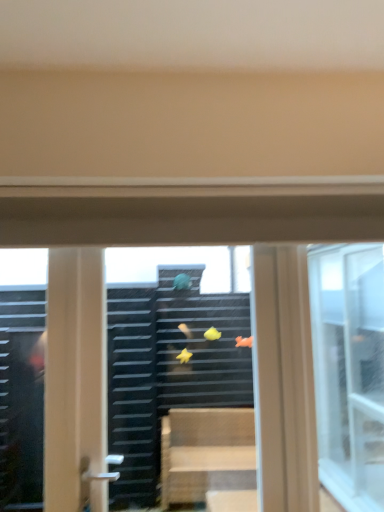
Find the location of a particular element. This screenshot has width=384, height=512. transparent plastic magnets at center is located at coordinates (167, 356).

Find the location of `transparent plastic magnets at center`. transparent plastic magnets at center is located at coordinates (x=167, y=356).

Which object is positioned more to the right, transparent glass window at center, the 1th window from the left, or transparent glass window at center, which ranks as the 2th window in left-to-right order?

From the viewer's perspective, transparent glass window at center, which ranks as the 2th window in left-to-right order, appears more on the right side.

From a real-world perspective, is transparent glass window at center, the 2th window from the right, positioned over transparent glass window at center, acting as the first window starting from the right, based on gravity?

No, from a real-world perspective, transparent glass window at center, the 2th window from the right, is not on top of transparent glass window at center, acting as the first window starting from the right.

Does transparent glass window at center, the 1th window from the left, turn towards transparent glass window at center, which ranks as the 2th window in left-to-right order?

Yes, transparent glass window at center, the 1th window from the left, faces towards transparent glass window at center, which ranks as the 2th window in left-to-right order.

Is transparent glass window at center, the 2th window from the right, a part of transparent glass window at center, acting as the first window starting from the right?

Actually, transparent glass window at center, the 2th window from the right, is outside transparent glass window at center, acting as the first window starting from the right.

From a real-world perspective, which is physically above, transparent glass window at center, which ranks as the 2th window in left-to-right order, or transparent glass window at center, the 1th window from the left?

From a 3D spatial view, transparent glass window at center, which ranks as the 2th window in left-to-right order, is above.

Is transparent glass window at center, acting as the first window starting from the right, in contact with transparent glass window at center, the 1th window from the left?

No, transparent glass window at center, acting as the first window starting from the right, is not touching transparent glass window at center, the 1th window from the left.

Is transparent glass window at center, which ranks as the 2th window in left-to-right order, shorter than transparent glass window at center, the 1th window from the left?

In fact, transparent glass window at center, which ranks as the 2th window in left-to-right order, may be taller than transparent glass window at center, the 1th window from the left.

Can you confirm if transparent plastic magnets at center is taller than transparent glass window at center, which ranks as the 2th window in left-to-right order?

Yes.

This screenshot has width=384, height=512. In order to click on the 2nd window counting from the right of the transparent plastic magnets at center in this screenshot , I will do `click(349, 370)`.

Is point (117, 252) behind point (354, 261)?

No, it is in front of (354, 261).

Who is more distant, transparent glass window at center, which ranks as the 2th window in left-to-right order, or transparent plastic magnets at center?

transparent glass window at center, which ranks as the 2th window in left-to-right order, is further from the camera.

Is transparent glass window at center, acting as the first window starting from the right, positioned with its back to transparent plastic magnets at center?

No, transparent glass window at center, acting as the first window starting from the right,'s orientation is not away from transparent plastic magnets at center.

Is transparent glass window at center, which ranks as the 2th window in left-to-right order, smaller than transparent plastic magnets at center?

Yes, transparent glass window at center, which ranks as the 2th window in left-to-right order, is smaller than transparent plastic magnets at center.

Which is behind, point (186, 366) or point (207, 384)?

The point (186, 366) is farther from the camera.

Relative to transparent plastic magnets at center, is transparent glass window at center, the 2th window from the right, in front or behind?

Clearly, transparent glass window at center, the 2th window from the right, is in front of transparent plastic magnets at center.

Does transparent glass window at center, the 1th window from the left, have a larger size compared to transparent plastic magnets at center?

Yes.

Could you tell me if transparent plastic magnets at center is facing transparent glass window at center, the 2th window from the right?

Yes, transparent plastic magnets at center is aimed at transparent glass window at center, the 2th window from the right.

Can you see transparent plastic magnets at center touching transparent glass window at center, the 1th window from the left?

Yes, transparent plastic magnets at center is right next to transparent glass window at center, the 1th window from the left, and making contact.

From the image's perspective, is transparent plastic magnets at center located beneath transparent glass window at center, the 1th window from the left?

Incorrect, from the image's perspective, transparent plastic magnets at center is higher than transparent glass window at center, the 1th window from the left.

What are the coordinates of `window located on the right of transparent glass window at center, the 2th window from the right` in the screenshot? It's located at click(x=349, y=370).

Locate an element on the screen. The height and width of the screenshot is (512, 384). window in front of the transparent glass window at center, which ranks as the 2th window in left-to-right order is located at coordinates (169, 365).

Estimate the real-world distances between objects in this image. Which object is further from transparent plastic magnets at center, transparent glass window at center, which ranks as the 2th window in left-to-right order, or transparent glass window at center, the 1th window from the left?

transparent glass window at center, which ranks as the 2th window in left-to-right order, lies further to transparent plastic magnets at center than the other object.

Based on their spatial positions, is transparent glass window at center, the 1th window from the left, or transparent glass window at center, which ranks as the 2th window in left-to-right order, further from transparent plastic magnets at center?

transparent glass window at center, which ranks as the 2th window in left-to-right order.

When comparing their distances from transparent glass window at center, acting as the first window starting from the right, does transparent plastic magnets at center or transparent glass window at center, the 1th window from the left, seem closer?

transparent glass window at center, the 1th window from the left, is closer to transparent glass window at center, acting as the first window starting from the right.

Considering their positions, is transparent plastic magnets at center positioned further to transparent glass window at center, the 1th window from the left, than transparent glass window at center, which ranks as the 2th window in left-to-right order?

transparent glass window at center, which ranks as the 2th window in left-to-right order.

Based on their spatial positions, is transparent glass window at center, acting as the first window starting from the right, or transparent plastic magnets at center closer to transparent glass window at center, the 2th window from the right?

Based on the image, transparent plastic magnets at center appears to be nearer to transparent glass window at center, the 2th window from the right.

Based on their spatial positions, is transparent glass window at center, the 1th window from the left, or transparent plastic magnets at center closer to transparent glass window at center, acting as the first window starting from the right?

transparent glass window at center, the 1th window from the left, is closer to transparent glass window at center, acting as the first window starting from the right.

Locate an element on the screen. The image size is (384, 512). window between transparent plastic magnets at center and transparent glass window at center, acting as the first window starting from the right is located at coordinates (169, 365).